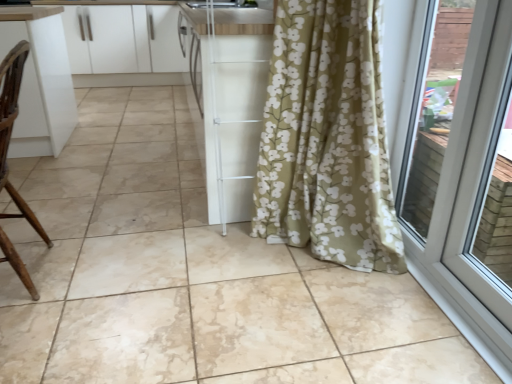
Find the location of a particular element. This screenshot has width=512, height=384. unoccupied space behind brown wood chair at left is located at coordinates (77, 225).